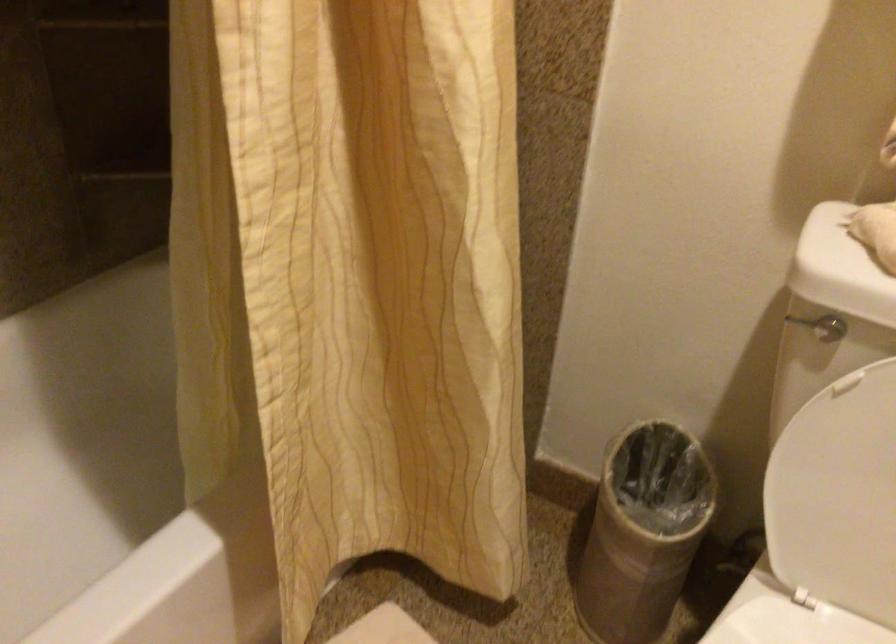
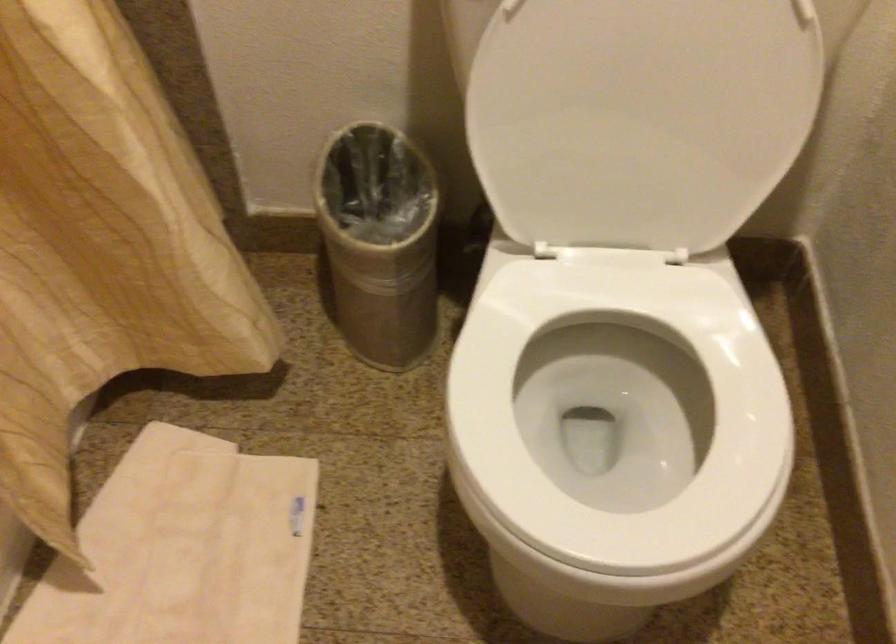
Find the pixel in the second image that matches point (648, 529) in the first image.

(380, 242)